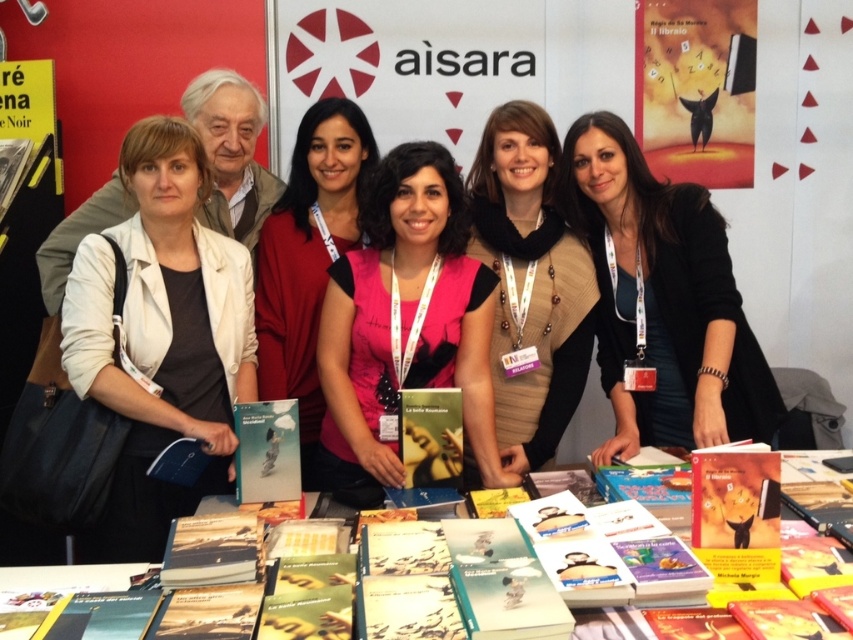
Looking at the scene of the book fair, there are a knitted beige sweater at center and a matte yellow book at center. Which object is positioned to the left?

The knitted beige sweater at center is to the left of the matte yellow book at center.

You are organizing a book fair booth and need to place a pink fabric at center and a hardcover book at center on a shelf. Which item should you place first to ensure both fit on the shelf?

The pink fabric at center has a larger width than the hardcover book at center, so you should place the pink fabric at center first to accommodate its size before placing the hardcover book at center.

You are organizing a book display and need to place both the knitted beige sweater at center and the hardcover book at center on a shelf. The shelf has limited space. Which item should you place first to maximize shelf space efficiency?

The knitted beige sweater at center has a larger width than the hardcover book at center, so placing the smaller item first might allow better space utilization. However, since the sweater is an object to be displayed alongside books, it might be more practical to place the hardcover book first to ensure it fits properly, then arrange the sweater around it.